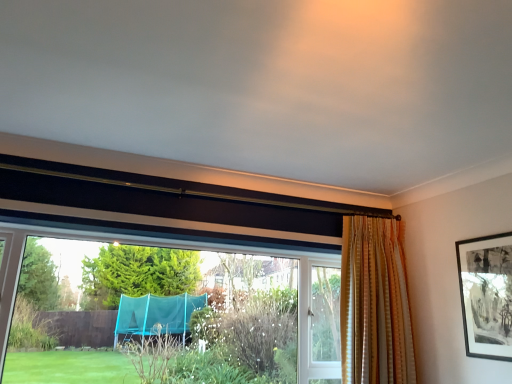
Find the location of a particular element. striped fabric curtain at right is located at coordinates (375, 304).

At what (x,y) coordinates should I click in order to perform the action: click on striped fabric curtain at right. Please return your answer as a coordinate pair (x, y). This screenshot has height=384, width=512. Looking at the image, I should click on (375, 304).

Who is smaller, striped fabric curtain at right or transparent plastic trampoline at lower left?

With smaller size is striped fabric curtain at right.

Does striped fabric curtain at right turn towards transparent plastic trampoline at lower left?

No.

Which is behind, point (397, 305) or point (26, 320)?

Point (26, 320)

Is point (460, 278) behind point (135, 305)?

No.

How many degrees apart are the facing directions of black matte picture frame at upper right and transparent plastic trampoline at lower left?

There is a 87.6-degree angle between the facing directions of black matte picture frame at upper right and transparent plastic trampoline at lower left.

Is the depth of black matte picture frame at upper right less than that of transparent plastic trampoline at lower left?

No.

From the picture: Is black matte picture frame at upper right to the right of transparent plastic trampoline at lower left from the viewer's perspective?

Correct, you'll find black matte picture frame at upper right to the right of transparent plastic trampoline at lower left.

Is striped fabric curtain at right positioned with its back to black matte picture frame at upper right?

No, black matte picture frame at upper right is not at the back of striped fabric curtain at right.

Is point (410, 348) in front of point (504, 314)?

No, it is not.

Considering the relative sizes of striped fabric curtain at right and black matte picture frame at upper right in the image provided, is striped fabric curtain at right thinner than black matte picture frame at upper right?

No.

From a real-world perspective, which is physically above, striped fabric curtain at right or black matte picture frame at upper right?

black matte picture frame at upper right is physically above.

Is transparent plastic trampoline at lower left to the left of black matte picture frame at upper right from the viewer's perspective?

Indeed, transparent plastic trampoline at lower left is positioned on the left side of black matte picture frame at upper right.

Locate an element on the screen. picture frame lying on the right of transparent plastic trampoline at lower left is located at coordinates (486, 295).

From a real-world perspective, which is physically above, transparent plastic trampoline at lower left or black matte picture frame at upper right?

From a 3D spatial view, black matte picture frame at upper right is above.

Between transparent plastic trampoline at lower left and black matte picture frame at upper right, which one has larger size?

transparent plastic trampoline at lower left is bigger.

Considering the relative sizes of black matte picture frame at upper right and striped fabric curtain at right in the image provided, is black matte picture frame at upper right wider than striped fabric curtain at right?

In fact, black matte picture frame at upper right might be narrower than striped fabric curtain at right.

From a real-world perspective, is black matte picture frame at upper right above or below striped fabric curtain at right?

In terms of real-world spatial position, black matte picture frame at upper right is above striped fabric curtain at right.

Between point (511, 296) and point (373, 224), which one is positioned in front?

The point (511, 296) is closer to the camera.

Is black matte picture frame at upper right positioned in front of striped fabric curtain at right?

Yes, the depth of black matte picture frame at upper right is less than that of striped fabric curtain at right.

Does transparent plastic trampoline at lower left appear on the right side of striped fabric curtain at right?

No, transparent plastic trampoline at lower left is not to the right of striped fabric curtain at right.

Based on the photo, do you think transparent plastic trampoline at lower left is within striped fabric curtain at right, or outside of it?

transparent plastic trampoline at lower left is outside striped fabric curtain at right.

In the scene shown: Is transparent plastic trampoline at lower left positioned behind striped fabric curtain at right?

No, transparent plastic trampoline at lower left is in front of striped fabric curtain at right.

Is point (161, 243) closer or farther from the camera than point (391, 373)?

Point (161, 243).

At what (x,y) coordinates should I click in order to perform the action: click on curtain above the transparent plastic trampoline at lower left (from a real-world perspective). Please return your answer as a coordinate pair (x, y). Looking at the image, I should click on point(375,304).

At what (x,y) coordinates should I click in order to perform the action: click on window below the black matte picture frame at upper right (from a real-world perspective). Please return your answer as a coordinate pair (x, y). Looking at the image, I should click on (167, 297).

Considering their positions, is black matte picture frame at upper right positioned further to striped fabric curtain at right than transparent plastic trampoline at lower left?

Based on the image, transparent plastic trampoline at lower left appears to be further to striped fabric curtain at right.

Considering their positions, is striped fabric curtain at right positioned further to black matte picture frame at upper right than transparent plastic trampoline at lower left?

transparent plastic trampoline at lower left is positioned further to the anchor black matte picture frame at upper right.

Considering their positions, is black matte picture frame at upper right positioned further to transparent plastic trampoline at lower left than striped fabric curtain at right?

The object further to transparent plastic trampoline at lower left is black matte picture frame at upper right.

Looking at the image, which one is located further to striped fabric curtain at right, transparent plastic trampoline at lower left or black matte picture frame at upper right?

Among the two, transparent plastic trampoline at lower left is located further to striped fabric curtain at right.

Which object lies further to the anchor point black matte picture frame at upper right, transparent plastic trampoline at lower left or striped fabric curtain at right?

transparent plastic trampoline at lower left.

Looking at the image, which one is located closer to transparent plastic trampoline at lower left, striped fabric curtain at right or black matte picture frame at upper right?

Among the two, striped fabric curtain at right is located nearer to transparent plastic trampoline at lower left.

I want to click on curtain between transparent plastic trampoline at lower left and black matte picture frame at upper right, so click(375, 304).